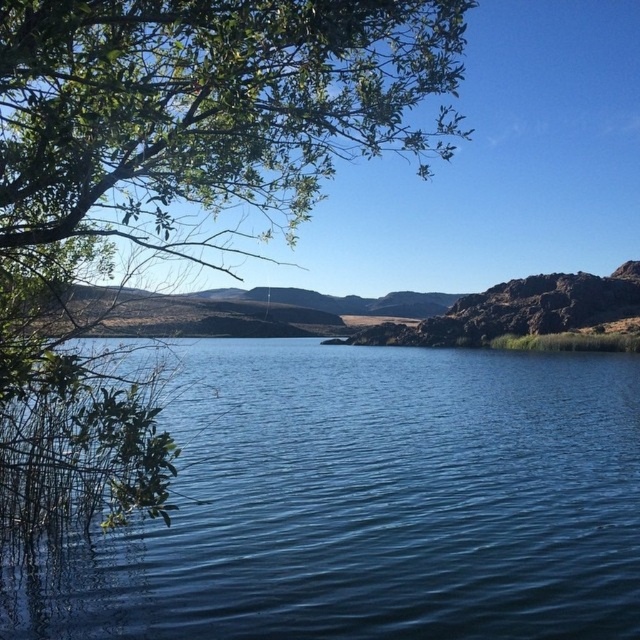
You are standing at the edge of the water and want to cross to the other side. The blue liquid water at center is in your path. Can you walk around the green leafy tree at upper left to avoid the water?

The blue liquid water at center is wider than the green leafy tree at upper left, so walking around the tree might not be possible as the water spans a greater distance.